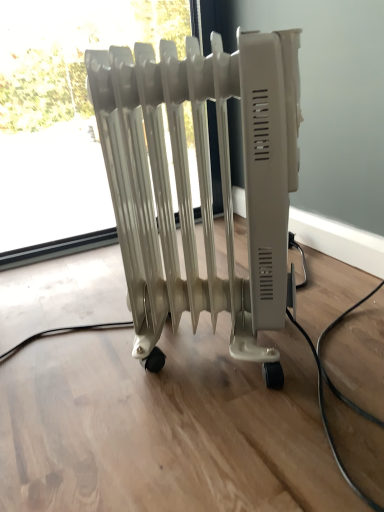
What do you see at coordinates (202, 181) in the screenshot?
I see `beige plastic radiator at center` at bounding box center [202, 181].

Locate an element on the screen. The image size is (384, 512). beige plastic radiator at center is located at coordinates (202, 181).

Image resolution: width=384 pixels, height=512 pixels. What are the coordinates of `beige plastic radiator at center` in the screenshot? It's located at (202, 181).